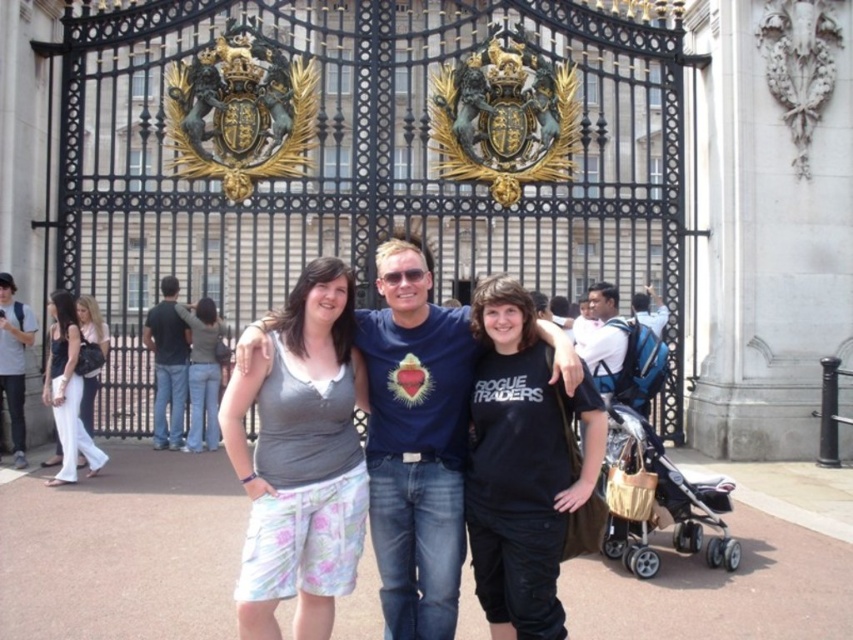
Question: Does gray fabric shorts at center appear on the right side of dark gray shirt at left?

Choices:
 (A) no
 (B) yes

Answer: (B)

Question: Does beige fabric stroller at lower right appear on the left side of white cotton dress at left?

Choices:
 (A) no
 (B) yes

Answer: (A)

Question: Which of the following is the closest to the observer?

Choices:
 (A) white cotton dress at left
 (B) matte white pants at left
 (C) dark gray shirt at left
 (D) matte blue t-shirt at center

Answer: (D)

Question: Can you confirm if white backpack at center is positioned to the left of white cotton dress at left?

Choices:
 (A) no
 (B) yes

Answer: (A)

Question: Based on their relative distances, which object is farther from the white backpack at center?

Choices:
 (A) matte gray tank top at center
 (B) gray fabric shorts at center

Answer: (A)

Question: Which point is closer to the camera taking this photo?

Choices:
 (A) (91, 465)
 (B) (105, 333)
 (C) (405, 342)

Answer: (C)